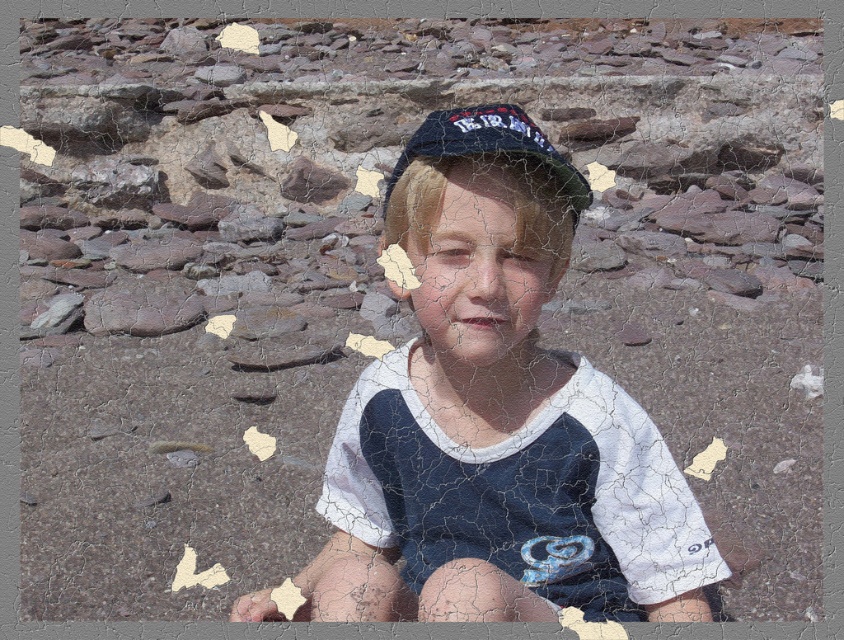
In the scene shown: You are standing in the image and want to place a small flag at the point closer to you between point (x=428, y=401) and point (x=512, y=125). Which point should you choose?

Point (x=428, y=401) is further to the viewer than point (x=512, y=125), so you should choose point (x=428, y=401) to place the flag.

Based on the photo, you are a photographer trying to capture the child in the image. You want to ensure the white mesh shirt at center and dark blue fabric baseball hat at center are both clearly visible. Which object should you focus on first to ensure both are in focus?

The white mesh shirt at center is in front of the dark blue fabric baseball hat at center, so focusing on the white mesh shirt at center first will ensure both are in focus since it is closer to the camera.